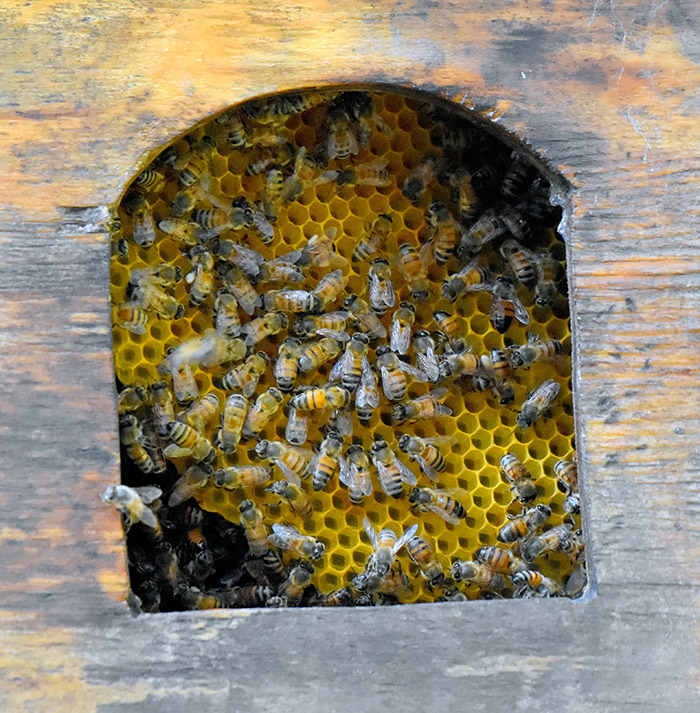
Locate an element on the screen. corner is located at coordinates (136, 600), (587, 585).